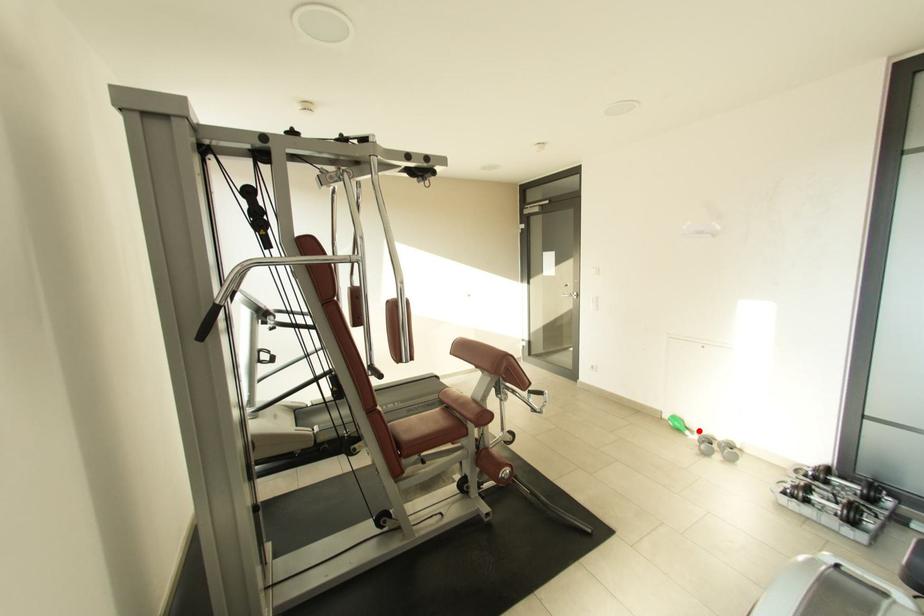
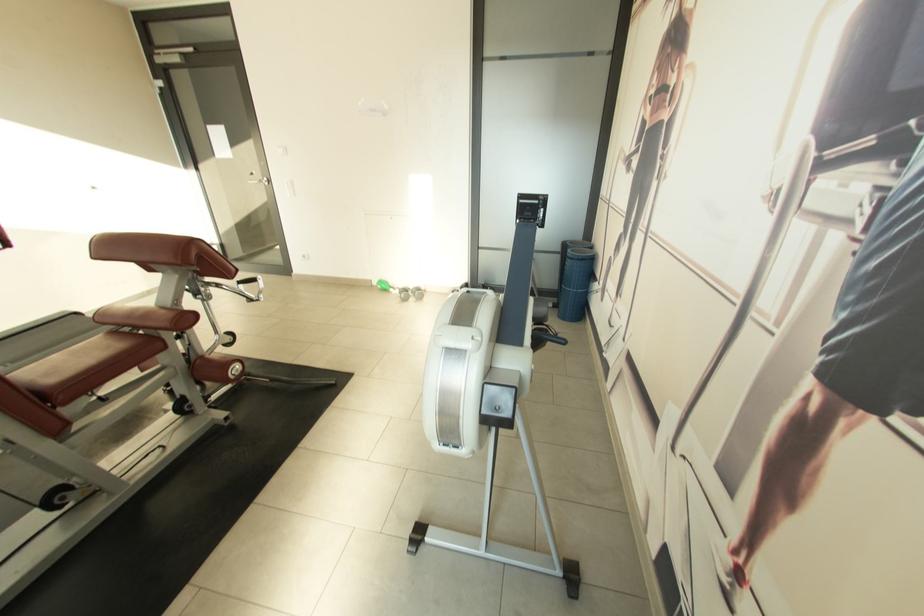
Where in the second image is the point corresponding to the highlighted location from the first image?

(400, 288)